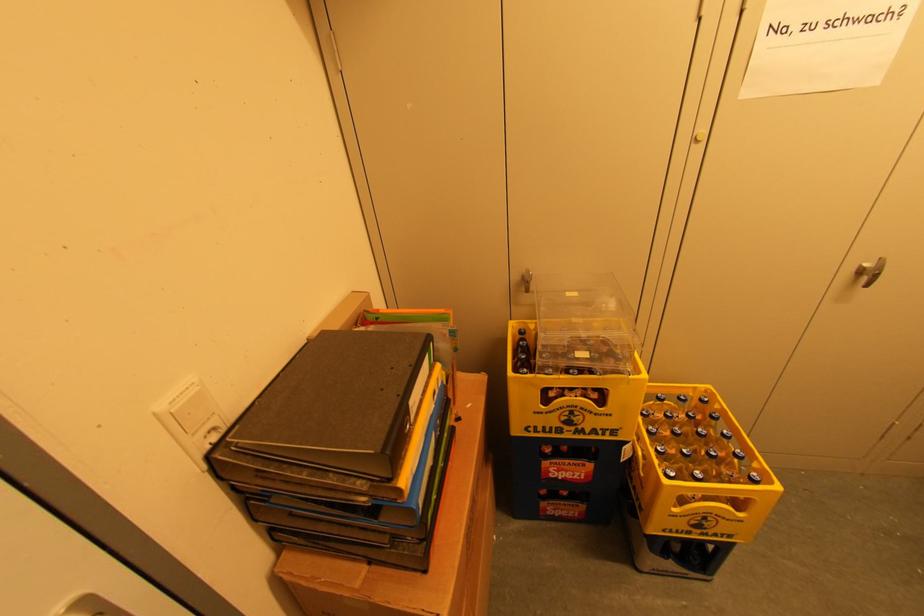
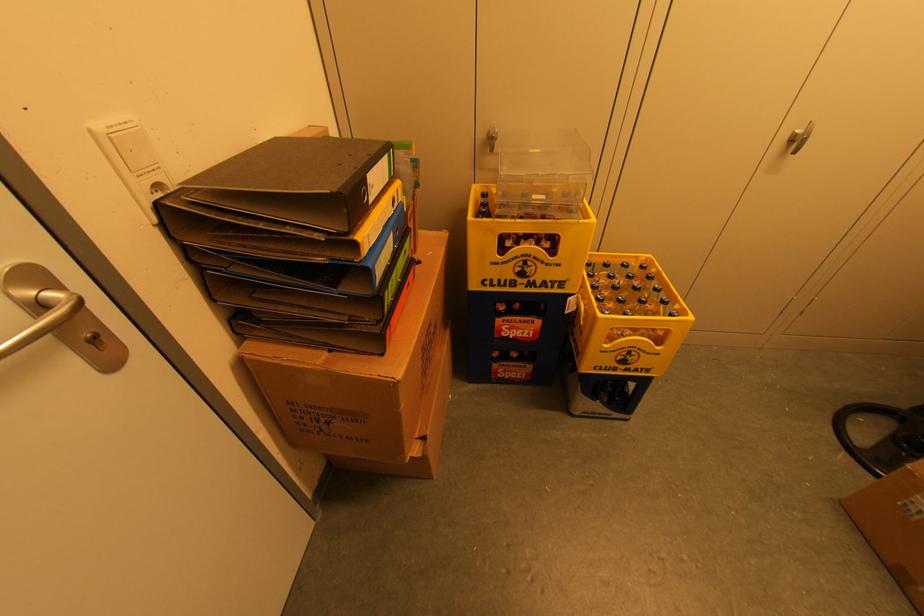
Find the pixel in the second image that matches (546,464) in the first image.

(501, 322)